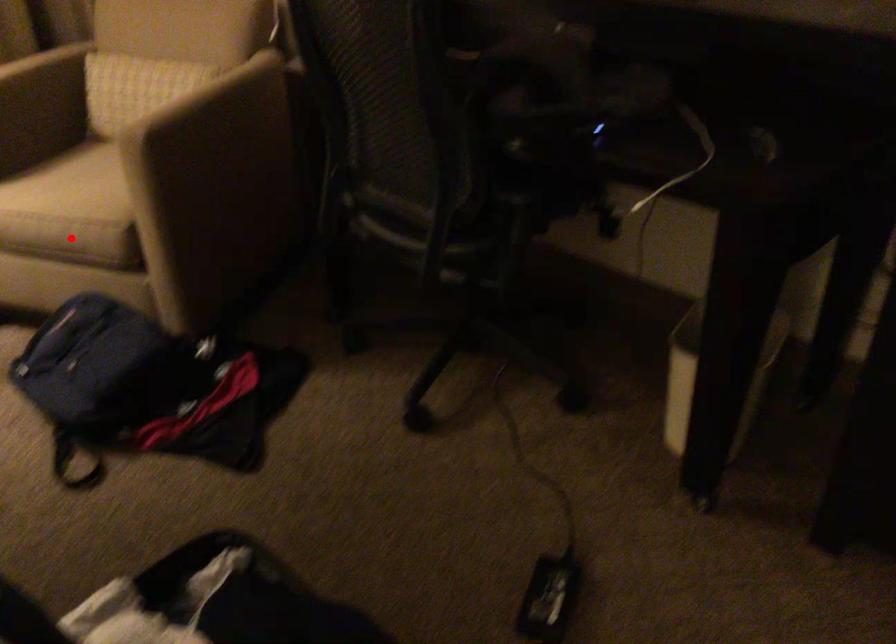
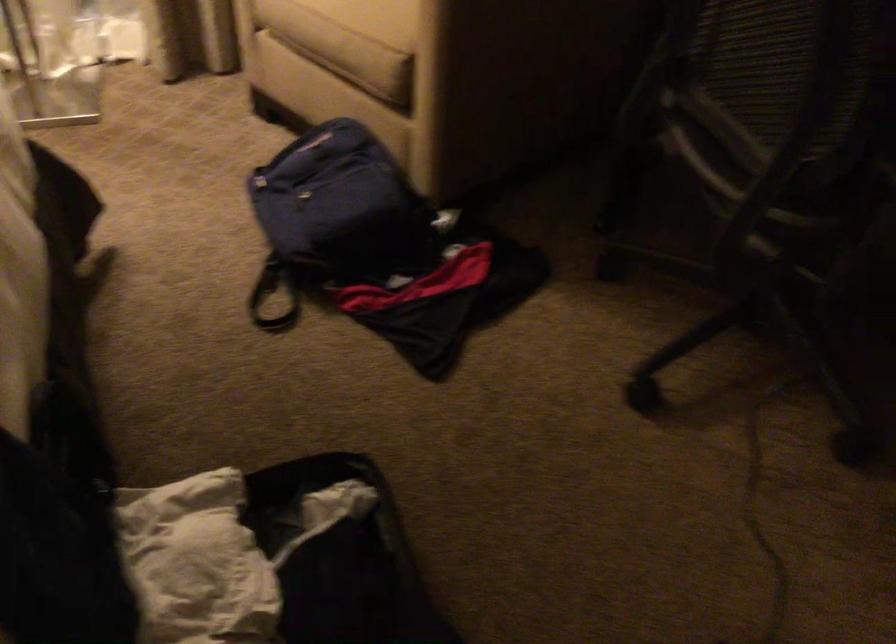
Question: I am providing you with two images of the same scene from different viewpoints. A red point is shown in image1. For the corresponding object point in image2, is it positioned nearer or farther from the camera?

Choices:
 (A) Nearer
 (B) Farther

Answer: (A)